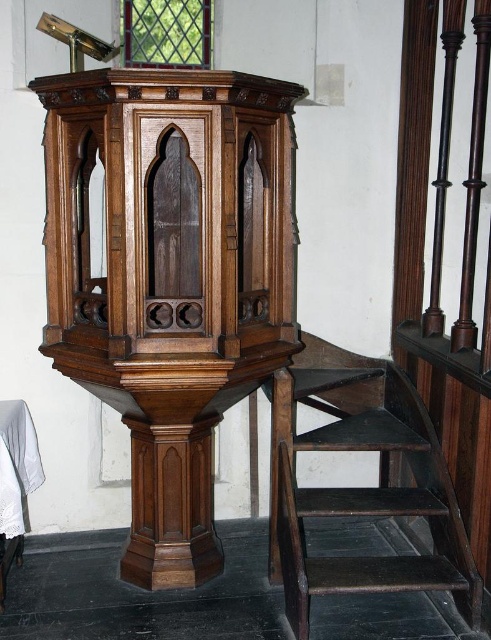
You are a visitor in the church and want to place a small white cloth on the polished wood pulpit at center. Can you determine if the white cloth at lower left will fit on the pulpit?

The polished wood pulpit at center is larger in size than the white cloth at lower left, so the cloth should fit comfortably on the pulpit.

You are an acoustics engineer assessing the sound quality of the church. You notice the polished wood pulpit at center and the white cloth at lower left. Which object is closer to the sound source if the sound originates from the pulpit?

The polished wood pulpit at center is closer to the sound source because it is the origin point, while the white cloth at lower left is behind it.